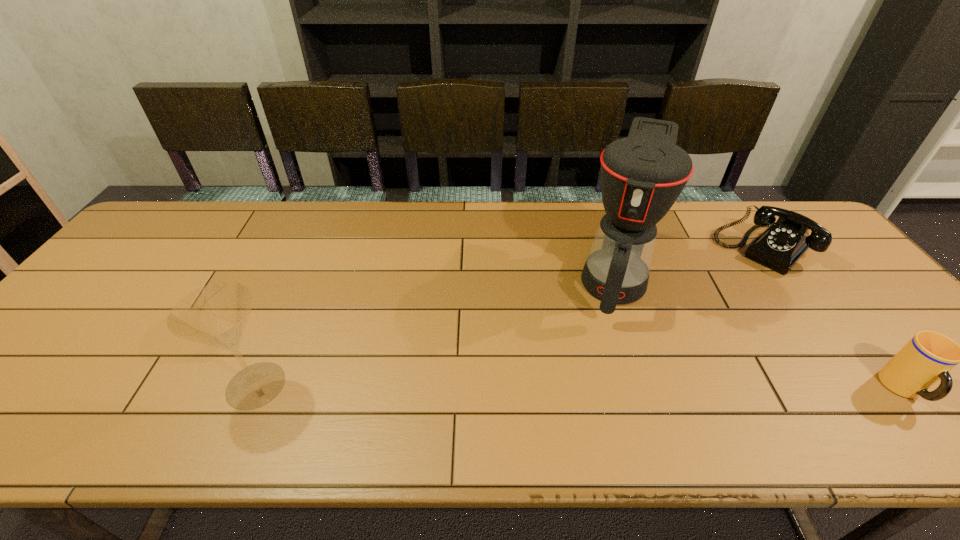
Image resolution: width=960 pixels, height=540 pixels. I want to click on the second tallest object, so click(215, 315).

What are the coordinates of `the leftmost object` in the screenshot? It's located at (215, 315).

You are a GUI agent. You are given a task and a screenshot of the screen. Output one action in this format:
    pyautogui.click(x=<x>, y=<y>)
    Task: Click on the cup
    Image resolution: width=960 pixels, height=540 pixels.
    Given the screenshot: What is the action you would take?
    pyautogui.click(x=928, y=357)

At what (x,y) coordinates should I click in order to perform the action: click on coffee maker. Please return your answer as a coordinate pair (x, y). This screenshot has height=540, width=960. Looking at the image, I should click on (642, 175).

You are a GUI agent. You are given a task and a screenshot of the screen. Output one action in this format:
    pyautogui.click(x=<x>, y=<y>)
    Task: Click on the tallest object
    
    Given the screenshot: What is the action you would take?
    pyautogui.click(x=642, y=175)

Identify the location of telephone. (784, 242).

Where is `blank space located 0.090m on the back of the flute glass`? This screenshot has height=540, width=960. blank space located 0.090m on the back of the flute glass is located at coordinates (280, 329).

Find the location of a particular element. This screenshot has width=960, height=540. vacant space located 0.180m pour from the carafe of the tallest object is located at coordinates (603, 382).

In order to click on vacant region located pour from the carafe of the tallest object in this screenshot , I will do `click(601, 389)`.

The width and height of the screenshot is (960, 540). In order to click on vacant space located 0.240m pour from the carafe of the tallest object in this screenshot , I will do `click(598, 404)`.